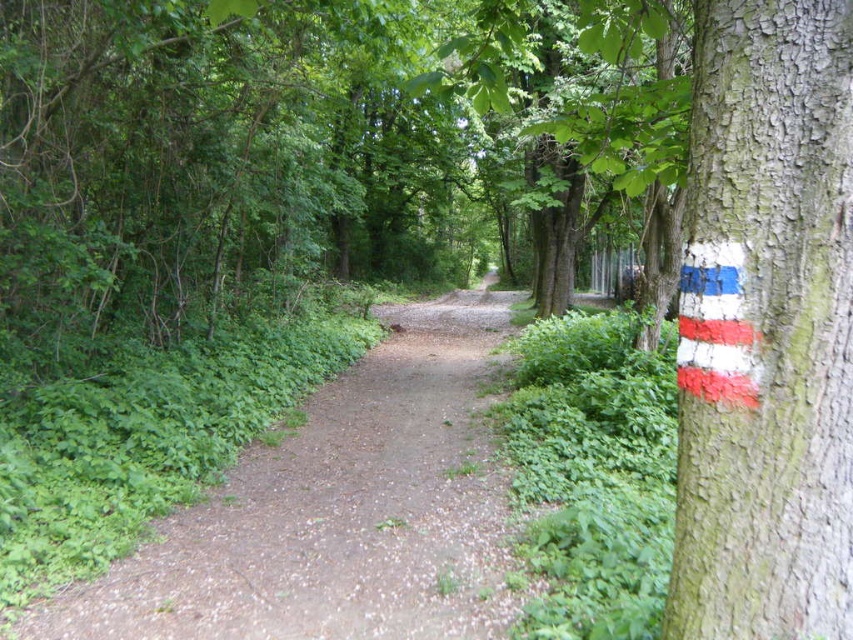
Question: From the image, what is the correct spatial relationship of smooth bark tree at right in relation to dirt path at center?

Choices:
 (A) right
 (B) left

Answer: (A)

Question: Can you confirm if smooth bark tree at right is wider than dirt path at center?

Choices:
 (A) no
 (B) yes

Answer: (A)

Question: Is smooth bark tree at right positioned in front of dirt path at center?

Choices:
 (A) no
 (B) yes

Answer: (B)

Question: Which point appears farthest from the camera in this image?

Choices:
 (A) tap(788, 378)
 (B) tap(339, 380)

Answer: (B)